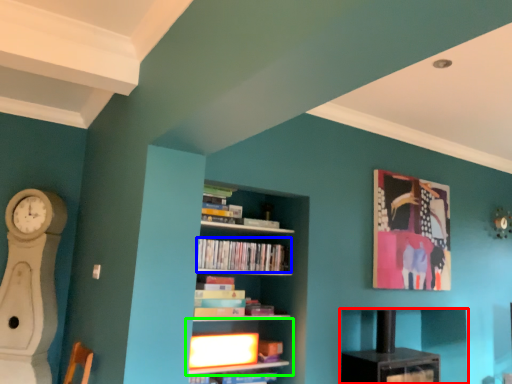
Question: Estimate the real-world distances between objects in this image. Which object is closer to shelf (highlighted by a red box), book (highlighted by a blue box) or shelf (highlighted by a green box)?

Choices:
 (A) book
 (B) shelf

Answer: (B)